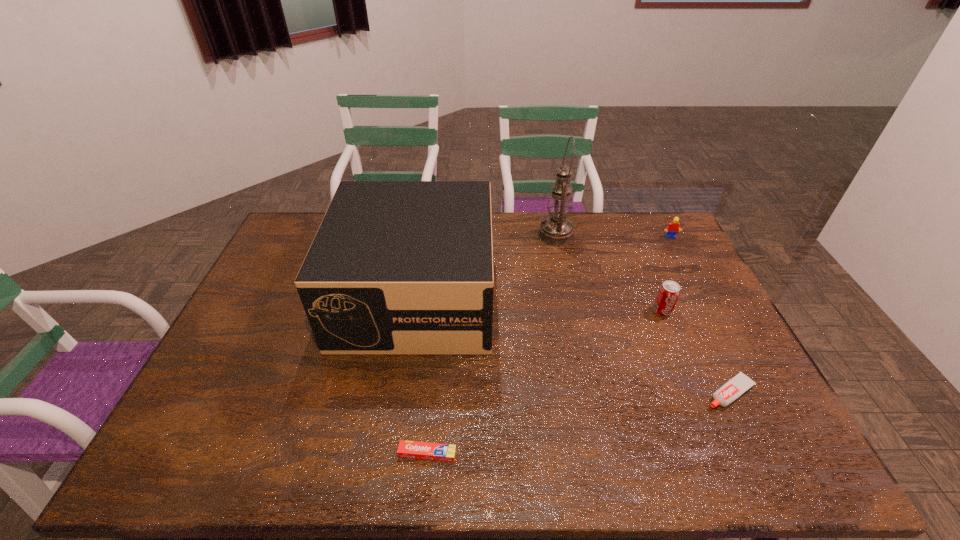
Identify the location of vacant region between the tallest object and the second nearest object. This screenshot has width=960, height=540. (642, 314).

This screenshot has height=540, width=960. Identify the location of free space between the fifth farthest object and the soda can. (696, 352).

Locate an element on the screen. Image resolution: width=960 pixels, height=540 pixels. free space between the box and the second nearest object is located at coordinates (572, 344).

This screenshot has width=960, height=540. I want to click on free space between the fourth tallest object and the soda can, so click(666, 274).

Image resolution: width=960 pixels, height=540 pixels. In order to click on vacant space that's between the third object from left to right and the Lego in this screenshot , I will do `click(612, 237)`.

I want to click on unoccupied position between the shorter toothpaste and the box, so click(421, 374).

I want to click on free spot between the Lego and the right toothpaste, so click(700, 315).

The image size is (960, 540). What are the coordinates of `blank region between the third tallest object and the left toothpaste` in the screenshot? It's located at (544, 382).

At what (x,y) coordinates should I click in order to perform the action: click on the fourth closest object relative to the fourth shortest object. Please return your answer as a coordinate pair (x, y). The height and width of the screenshot is (540, 960). Looking at the image, I should click on (396, 267).

The width and height of the screenshot is (960, 540). Identify the location of object identified as the fourth closest to the soda can. (396, 267).